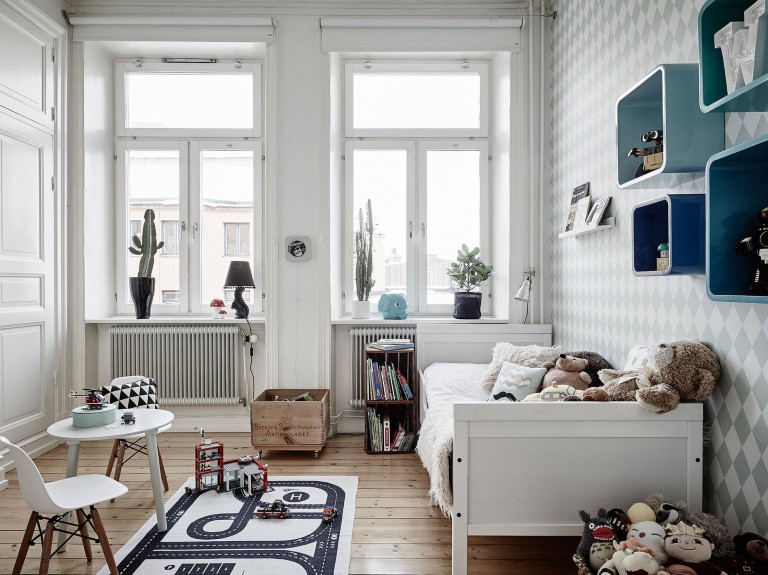
Where is `small shelf`? The image size is (768, 575). small shelf is located at coordinates (392, 394).